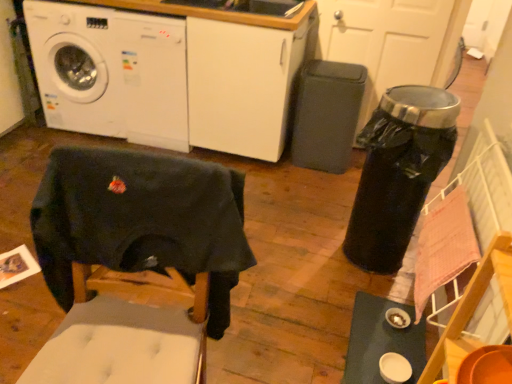
Based on the photo, how much space does white glossy washing machine at upper left, marked as the first washing machine in a right-to-left arrangement, occupy vertically?

white glossy washing machine at upper left, marked as the first washing machine in a right-to-left arrangement, is 91.89 centimeters tall.

The height and width of the screenshot is (384, 512). What do you see at coordinates (111, 72) in the screenshot? I see `white glossy washing machine at upper left, the 1th washing machine when ordered from left to right` at bounding box center [111, 72].

What do you see at coordinates (381, 340) in the screenshot?
I see `white glossy table at lower right` at bounding box center [381, 340].

This screenshot has width=512, height=384. I want to click on white glossy washing machine at upper left, the second washing machine in the left-to-right sequence, so click(153, 79).

Locate an element on the screen. This screenshot has width=512, height=384. washing machine above the white glossy washing machine at upper left, marked as the first washing machine in a right-to-left arrangement (from the image's perspective) is located at coordinates (111, 72).

Would you say white glossy washing machine at upper left, the second washing machine in the left-to-right sequence, is to the left or to the right of white glossy washing machine at upper left, the 1th washing machine when ordered from left to right, in the picture?

Based on their positions, white glossy washing machine at upper left, the second washing machine in the left-to-right sequence, is located to the right of white glossy washing machine at upper left, the 1th washing machine when ordered from left to right.

Is point (143, 16) closer to viewer compared to point (138, 103)?

That is True.

From a real-world perspective, which is physically below, white glossy washing machine at upper left, marked as the first washing machine in a right-to-left arrangement, or white glossy washing machine at upper left, which is the 2th washing machine in right-to-left order?

white glossy washing machine at upper left, which is the 2th washing machine in right-to-left order.

Considering the positions of point (56, 291) and point (128, 120), is point (56, 291) closer or farther from the camera than point (128, 120)?

Point (56, 291) appears to be closer to the viewer than point (128, 120).

In the scene shown: Is dark fabric swivel chair at lower left aimed at white glossy washing machine at upper left, which is the 2th washing machine in right-to-left order?

No, dark fabric swivel chair at lower left does not turn towards white glossy washing machine at upper left, which is the 2th washing machine in right-to-left order.

Considering the positions of objects dark fabric swivel chair at lower left and white glossy washing machine at upper left, the 1th washing machine when ordered from left to right, in the image provided, who is more to the right, dark fabric swivel chair at lower left or white glossy washing machine at upper left, the 1th washing machine when ordered from left to right,?

Positioned to the right is dark fabric swivel chair at lower left.

From the image's perspective, is white glossy table at lower right located above or below white glossy washing machine at upper left, the 1th washing machine when ordered from left to right?

Based on their image positions, white glossy table at lower right is located beneath white glossy washing machine at upper left, the 1th washing machine when ordered from left to right.

From a real-world perspective, is white glossy table at lower right located higher than white glossy washing machine at upper left, the 1th washing machine when ordered from left to right?

Incorrect, from a real-world perspective, white glossy table at lower right is lower than white glossy washing machine at upper left, the 1th washing machine when ordered from left to right.

Which is more to the left, white glossy table at lower right or white glossy washing machine at upper left, which is the 2th washing machine in right-to-left order?

Positioned to the left is white glossy washing machine at upper left, which is the 2th washing machine in right-to-left order.

Considering the sizes of objects white glossy table at lower right and white glossy washing machine at upper left, which is the 2th washing machine in right-to-left order, in the image provided, who is shorter, white glossy table at lower right or white glossy washing machine at upper left, which is the 2th washing machine in right-to-left order,?

white glossy table at lower right is shorter.

Is dark fabric swivel chair at lower left positioned behind white glossy table at lower right?

No.

Between dark fabric swivel chair at lower left and white glossy table at lower right, which one has larger width?

white glossy table at lower right is wider.

Is dark fabric swivel chair at lower left far away from white glossy table at lower right?

dark fabric swivel chair at lower left is near white glossy table at lower right, not far away.

How distant is dark fabric swivel chair at lower left from white glossy table at lower right?

A distance of 33.90 inches exists between dark fabric swivel chair at lower left and white glossy table at lower right.

Does point (123, 67) come behind point (364, 313)?

Yes.

What's the angular difference between white glossy washing machine at upper left, which is the 2th washing machine in right-to-left order, and white glossy table at lower right's facing directions?

94 degrees separate the facing orientations of white glossy washing machine at upper left, which is the 2th washing machine in right-to-left order, and white glossy table at lower right.

Can you confirm if white glossy washing machine at upper left, which is the 2th washing machine in right-to-left order, is positioned to the left of white glossy table at lower right?

Correct, you'll find white glossy washing machine at upper left, which is the 2th washing machine in right-to-left order, to the left of white glossy table at lower right.

Is white glossy washing machine at upper left, which is the 2th washing machine in right-to-left order, turned away from white glossy table at lower right?

No, white glossy washing machine at upper left, which is the 2th washing machine in right-to-left order, is not facing the opposite direction of white glossy table at lower right.

Which is behind, point (158, 139) or point (181, 199)?

Point (158, 139)

Is dark fabric swivel chair at lower left located within white glossy washing machine at upper left, marked as the first washing machine in a right-to-left arrangement?

No, dark fabric swivel chair at lower left is located outside of white glossy washing machine at upper left, marked as the first washing machine in a right-to-left arrangement.

Is white glossy washing machine at upper left, marked as the first washing machine in a right-to-left arrangement, not close to dark fabric swivel chair at lower left?

Yes, white glossy washing machine at upper left, marked as the first washing machine in a right-to-left arrangement, is far from dark fabric swivel chair at lower left.

Between white glossy washing machine at upper left, marked as the first washing machine in a right-to-left arrangement, and dark fabric swivel chair at lower left, which one is positioned in front?

dark fabric swivel chair at lower left.

From a real-world perspective, which object stands above the other?

From a 3D spatial view, white glossy washing machine at upper left, the second washing machine in the left-to-right sequence, is above.

Would you say white glossy washing machine at upper left, the 1th washing machine when ordered from left to right, is to the left or to the right of white glossy washing machine at upper left, the second washing machine in the left-to-right sequence, in the picture?

Based on their positions, white glossy washing machine at upper left, the 1th washing machine when ordered from left to right, is located to the left of white glossy washing machine at upper left, the second washing machine in the left-to-right sequence.

Which object is wider, white glossy washing machine at upper left, the 1th washing machine when ordered from left to right, or white glossy washing machine at upper left, the second washing machine in the left-to-right sequence?

Wider between the two is white glossy washing machine at upper left, the 1th washing machine when ordered from left to right.

Relative to white glossy washing machine at upper left, marked as the first washing machine in a right-to-left arrangement, is white glossy washing machine at upper left, the 1th washing machine when ordered from left to right, in front or behind?

In the image, white glossy washing machine at upper left, the 1th washing machine when ordered from left to right, appears behind white glossy washing machine at upper left, marked as the first washing machine in a right-to-left arrangement.

Find the location of a particular element. The height and width of the screenshot is (384, 512). washing machine that appears in front of the white glossy washing machine at upper left, the 1th washing machine when ordered from left to right is located at coordinates click(x=153, y=79).

The width and height of the screenshot is (512, 384). I want to click on the 2nd washing machine counting from the left side of the dark fabric swivel chair at lower left, so click(x=111, y=72).

Which object lies nearer to the anchor point white glossy washing machine at upper left, the 1th washing machine when ordered from left to right, dark fabric swivel chair at lower left or white glossy table at lower right?

Among the two, dark fabric swivel chair at lower left is located nearer to white glossy washing machine at upper left, the 1th washing machine when ordered from left to right.

When comparing their distances from dark fabric swivel chair at lower left, does white glossy washing machine at upper left, marked as the first washing machine in a right-to-left arrangement, or white glossy washing machine at upper left, the 1th washing machine when ordered from left to right, seem closer?

white glossy washing machine at upper left, marked as the first washing machine in a right-to-left arrangement, lies closer to dark fabric swivel chair at lower left than the other object.

When comparing their distances from white glossy table at lower right, does dark fabric swivel chair at lower left or white glossy washing machine at upper left, which is the 2th washing machine in right-to-left order, seem further?

Based on the image, white glossy washing machine at upper left, which is the 2th washing machine in right-to-left order, appears to be further to white glossy table at lower right.

Estimate the real-world distances between objects in this image. Which object is closer to white glossy table at lower right, white glossy washing machine at upper left, the 1th washing machine when ordered from left to right, or dark fabric swivel chair at lower left?

dark fabric swivel chair at lower left is closer to white glossy table at lower right.

Which object lies nearer to the anchor point dark fabric swivel chair at lower left, white glossy washing machine at upper left, marked as the first washing machine in a right-to-left arrangement, or white glossy table at lower right?

white glossy table at lower right is positioned closer to the anchor dark fabric swivel chair at lower left.

From the image, which object appears to be farther from white glossy table at lower right, dark fabric swivel chair at lower left or white glossy washing machine at upper left, marked as the first washing machine in a right-to-left arrangement?

white glossy washing machine at upper left, marked as the first washing machine in a right-to-left arrangement.

Based on their spatial positions, is white glossy washing machine at upper left, the 1th washing machine when ordered from left to right, or dark fabric swivel chair at lower left closer to white glossy washing machine at upper left, the second washing machine in the left-to-right sequence?

white glossy washing machine at upper left, the 1th washing machine when ordered from left to right.

Based on the photo, when comparing their distances from white glossy washing machine at upper left, the 1th washing machine when ordered from left to right, does white glossy washing machine at upper left, the second washing machine in the left-to-right sequence, or dark fabric swivel chair at lower left seem closer?

Among the two, white glossy washing machine at upper left, the second washing machine in the left-to-right sequence, is located nearer to white glossy washing machine at upper left, the 1th washing machine when ordered from left to right.

This screenshot has width=512, height=384. Find the location of `swivel chair between white glossy washing machine at upper left, the 1th washing machine when ordered from left to right, and white glossy table at lower right, in the horizontal direction`. swivel chair between white glossy washing machine at upper left, the 1th washing machine when ordered from left to right, and white glossy table at lower right, in the horizontal direction is located at coordinates (141, 221).

The image size is (512, 384). In order to click on washing machine that lies between white glossy washing machine at upper left, the 1th washing machine when ordered from left to right, and white glossy table at lower right from top to bottom in this screenshot , I will do `click(153, 79)`.

This screenshot has width=512, height=384. Identify the location of washing machine positioned between dark fabric swivel chair at lower left and white glossy washing machine at upper left, which is the 2th washing machine in right-to-left order, from near to far. (153, 79).

Where is `swivel chair between white glossy washing machine at upper left, the second washing machine in the left-to-right sequence, and white glossy table at lower right vertically`? This screenshot has height=384, width=512. swivel chair between white glossy washing machine at upper left, the second washing machine in the left-to-right sequence, and white glossy table at lower right vertically is located at coordinates (141, 221).